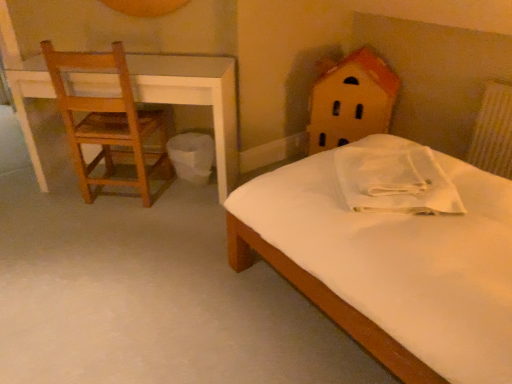
At what (x,y) coordinates should I click in order to perform the action: click on free spot above white matte bed at center (from a real-world perspective). Please return your answer as a coordinate pair (x, y). Looking at the image, I should click on (163, 268).